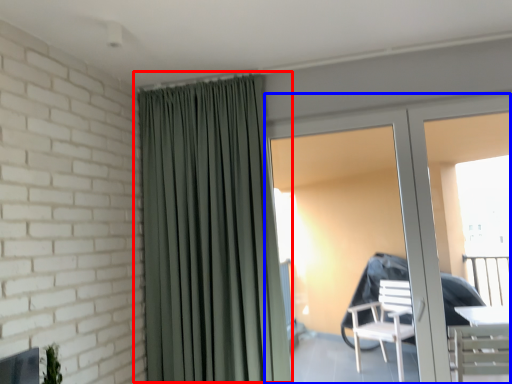
Question: Which object is closer to the camera taking this photo, curtain (highlighted by a red box) or door (highlighted by a blue box)?

Choices:
 (A) curtain
 (B) door

Answer: (A)